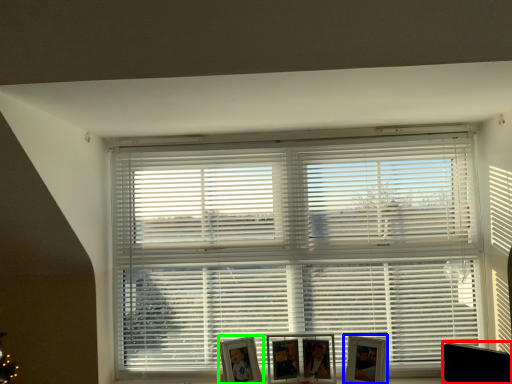
Question: Based on their relative distances, which object is farther from swivel chair (highlighted by a red box)? Choose from picture frame (highlighted by a blue box) and picture frame (highlighted by a green box).

Choices:
 (A) picture frame
 (B) picture frame

Answer: (B)